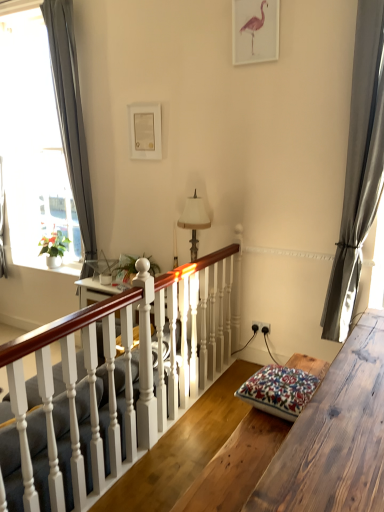
Where is `vacant area that is in front of floral-patterned fabric cushion at lower right`? The image size is (384, 512). vacant area that is in front of floral-patterned fabric cushion at lower right is located at coordinates (257, 440).